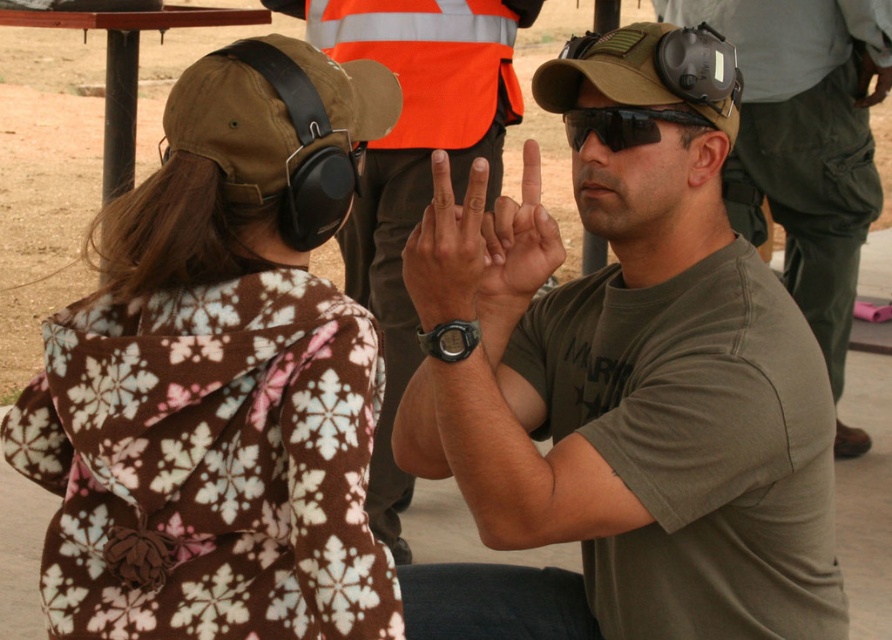
Question: Does orange reflective safety vest at center appear over matte black watch at center?

Choices:
 (A) no
 (B) yes

Answer: (B)

Question: Is brown fleece jacket at left further to camera compared to black matte goggles at center?

Choices:
 (A) no
 (B) yes

Answer: (A)

Question: Which object is farther from the camera taking this photo?

Choices:
 (A) black matte goggles at center
 (B) orange reflective vest at center
 (C) matte black watch at center
 (D) orange reflective safety vest at center

Answer: (B)

Question: Among these objects, which one is nearest to the camera?

Choices:
 (A) olive green t-shirt at center
 (B) matte skin hand at center
 (C) black matte goggles at center

Answer: (A)

Question: Among these points, which one is farthest from the camera?

Choices:
 (A) (581, 124)
 (B) (351, 624)
 (C) (544, 241)

Answer: (A)

Question: Does brown fleece jacket at left appear under orange reflective safety vest at center?

Choices:
 (A) no
 (B) yes

Answer: (B)